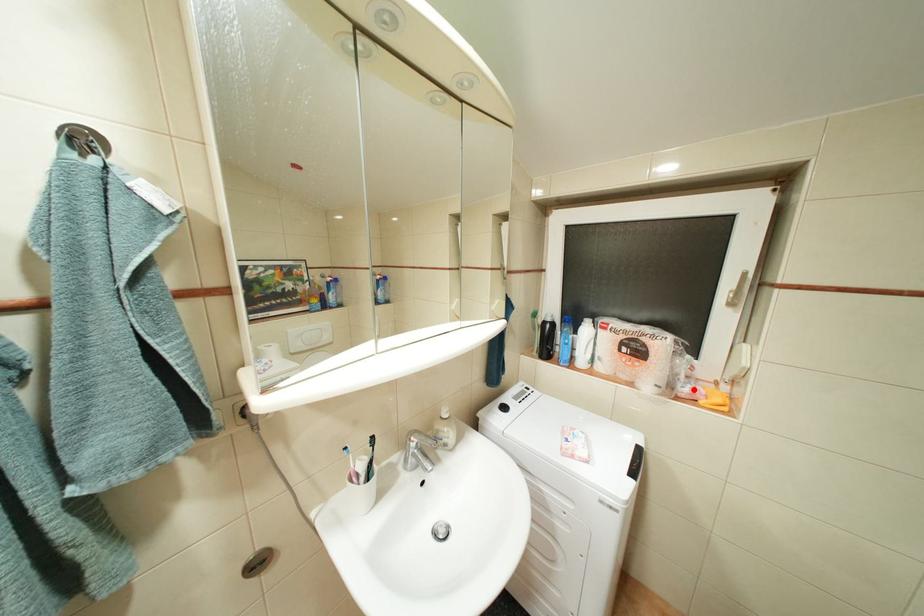
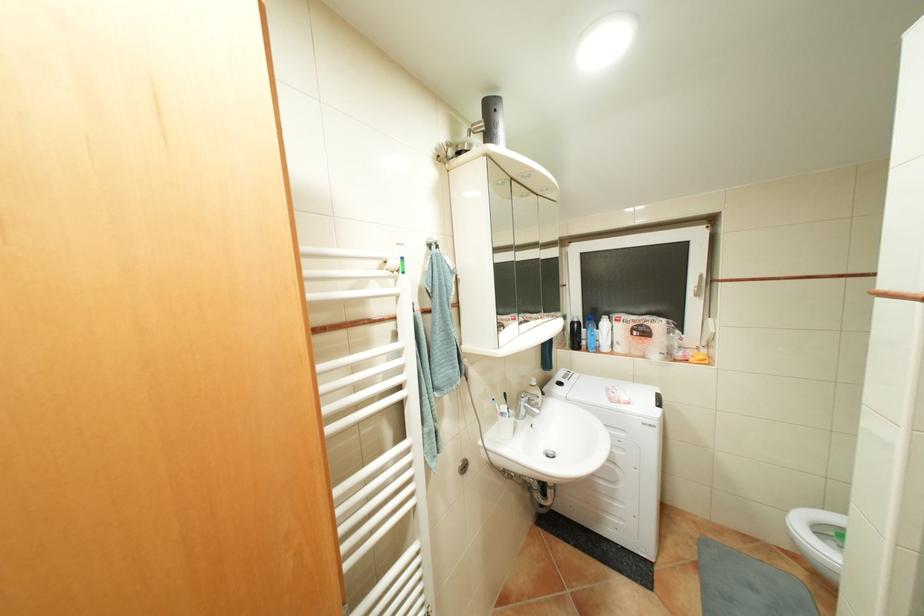
Where in the second image is the point corresponding to the highlighted location from the first image?

(688, 354)